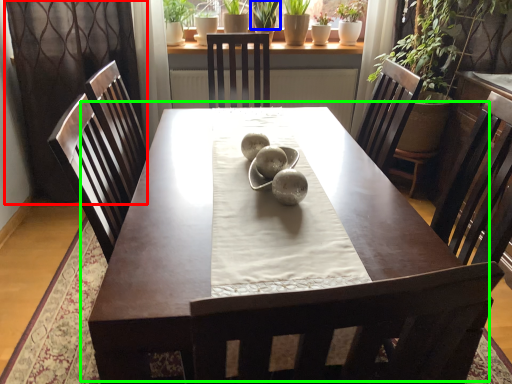
Question: Considering the real-world distances, which object is farthest from curtain (highlighted by a red box)? plant (highlighted by a blue box) or table (highlighted by a green box)?

Choices:
 (A) plant
 (B) table

Answer: (A)